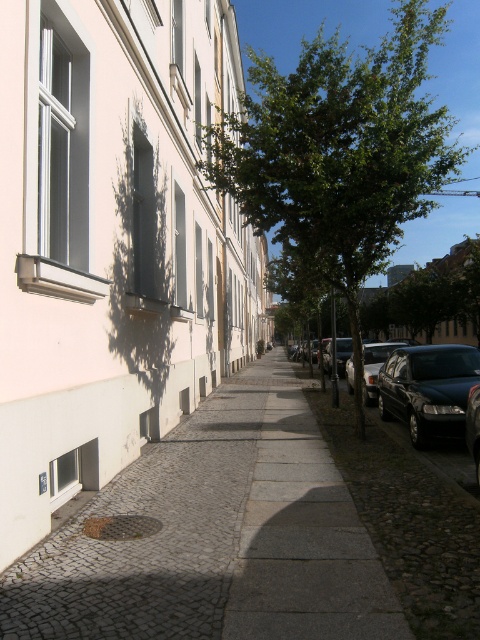
How much distance is there between shiny black sedan at right and shiny silver car at center?

They are 7.92 meters apart.

Between shiny black sedan at right and shiny silver car at center, which one has more height?

With more height is shiny silver car at center.

This screenshot has width=480, height=640. Find the location of `shiny black sedan at right`. shiny black sedan at right is located at coordinates click(428, 388).

Does cobblestone pavement at lower left have a lesser width compared to green leafy tree at center?

Yes, cobblestone pavement at lower left is thinner than green leafy tree at center.

Can you confirm if cobblestone pavement at lower left is taller than green leafy tree at center?

No, cobblestone pavement at lower left is not taller than green leafy tree at center.

Which is in front, point (235, 472) or point (343, 180)?

Positioned in front is point (235, 472).

The image size is (480, 640). In order to click on cobblestone pavement at lower left in this screenshot , I will do `click(216, 536)`.

Is cobblestone pavement at lower left positioned before shiny silver car at center right?

Yes, it is in front of shiny silver car at center right.

Between point (168, 616) and point (371, 376), which one is positioned in front?

Positioned in front is point (168, 616).

I want to click on cobblestone pavement at lower left, so click(216, 536).